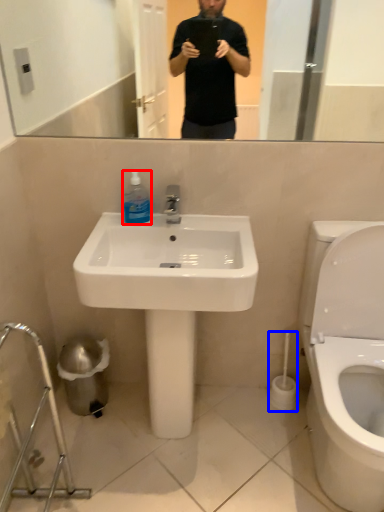
Question: Which object appears closest to the camera in this image, cleaning product (highlighted by a red box) or brush (highlighted by a blue box)?

Choices:
 (A) cleaning product
 (B) brush

Answer: (A)